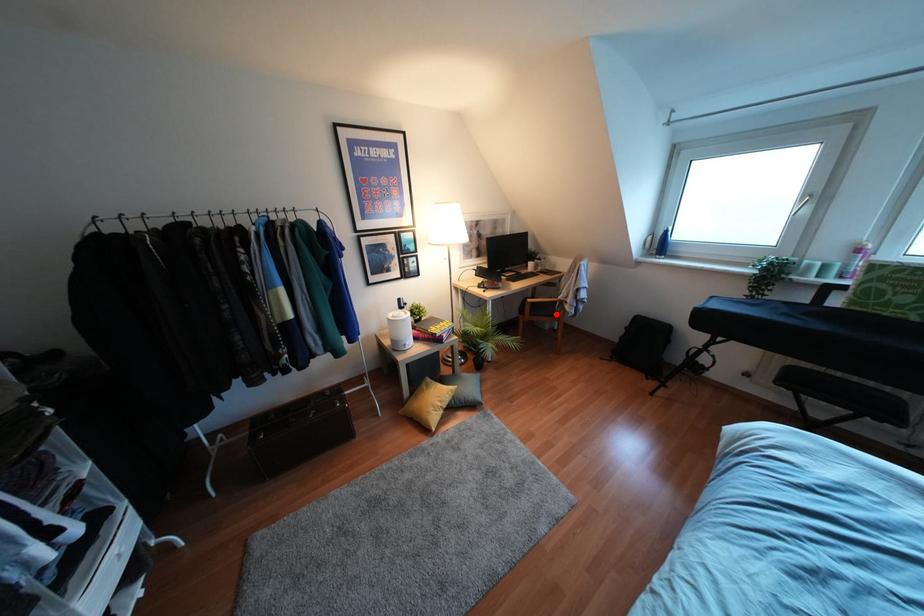
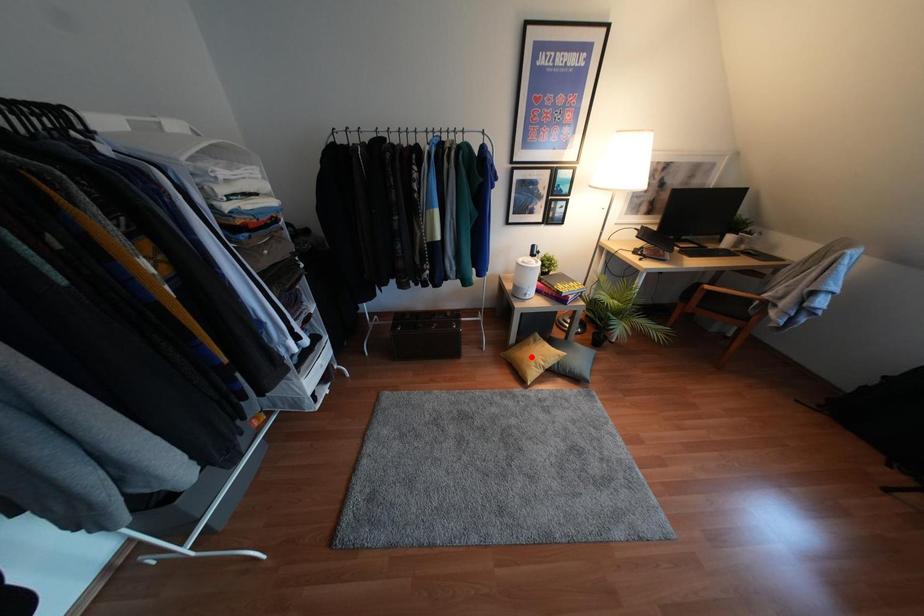
I am providing you with two images of the same scene from different viewpoints. A red point is marked on the first image and another point is marked on the second image. Does the point marked in image1 correspond to the same location as the one in image2?

No